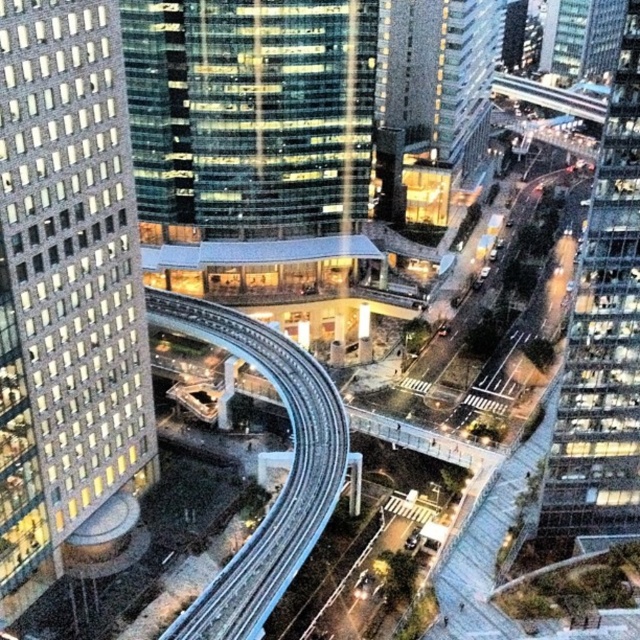
Question: Does matte glass tower at left lie behind glassy reflective skyscraper at center?

Choices:
 (A) no
 (B) yes

Answer: (A)

Question: Is glassy reflective skyscraper at center to the right of transparent glass skyscraper at right from the viewer's perspective?

Choices:
 (A) no
 (B) yes

Answer: (A)

Question: Which point is farther to the camera?

Choices:
 (A) transparent glass skyscraper at right
 (B) metallic silver train track at center
 (C) matte glass tower at left
 (D) glassy reflective skyscraper at center

Answer: (D)

Question: Is transparent glass skyscraper at right smaller than metallic silver train track at center?

Choices:
 (A) yes
 (B) no

Answer: (A)

Question: Which of these objects is positioned closest to the metallic silver train track at center?

Choices:
 (A) glassy reflective skyscraper at center
 (B) transparent glass skyscraper at right

Answer: (B)

Question: Which is farther from the matte glass tower at left?

Choices:
 (A) metallic silver train track at center
 (B) transparent glass skyscraper at right

Answer: (B)